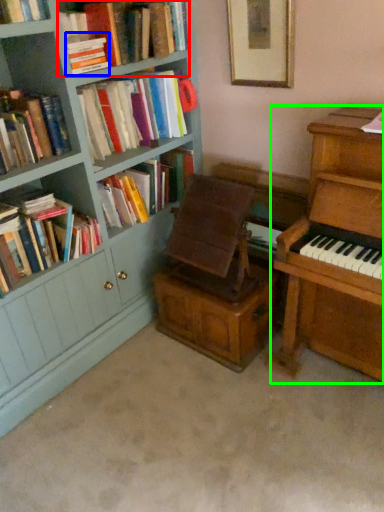
Question: Which is farther away from book (highlighted by a red box)? book (highlighted by a blue box) or piano (highlighted by a green box)?

Choices:
 (A) book
 (B) piano

Answer: (B)